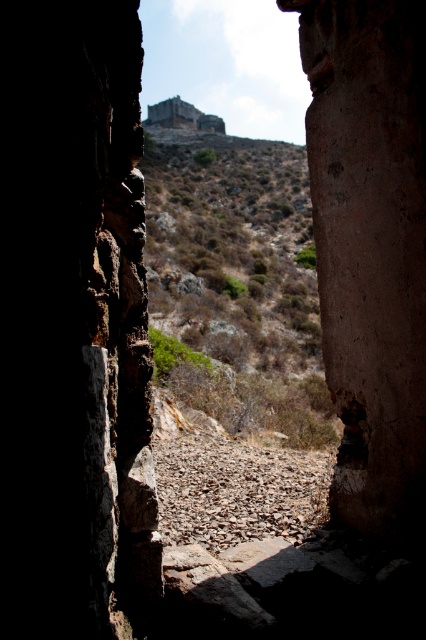
Question: Can you confirm if smooth stone hole at center is positioned below rustic stone ruins at upper center?

Choices:
 (A) no
 (B) yes

Answer: (B)

Question: Among these points, which one is farthest from the camera?

Choices:
 (A) (342, 460)
 (B) (221, 124)

Answer: (B)

Question: Which object is farther from the camera taking this photo?

Choices:
 (A) rustic stone ruins at upper center
 (B) smooth stone hole at center

Answer: (A)

Question: Does smooth stone hole at center have a smaller size compared to rustic stone ruins at upper center?

Choices:
 (A) yes
 (B) no

Answer: (A)

Question: Does smooth stone hole at center have a smaller size compared to rustic stone ruins at upper center?

Choices:
 (A) no
 (B) yes

Answer: (B)